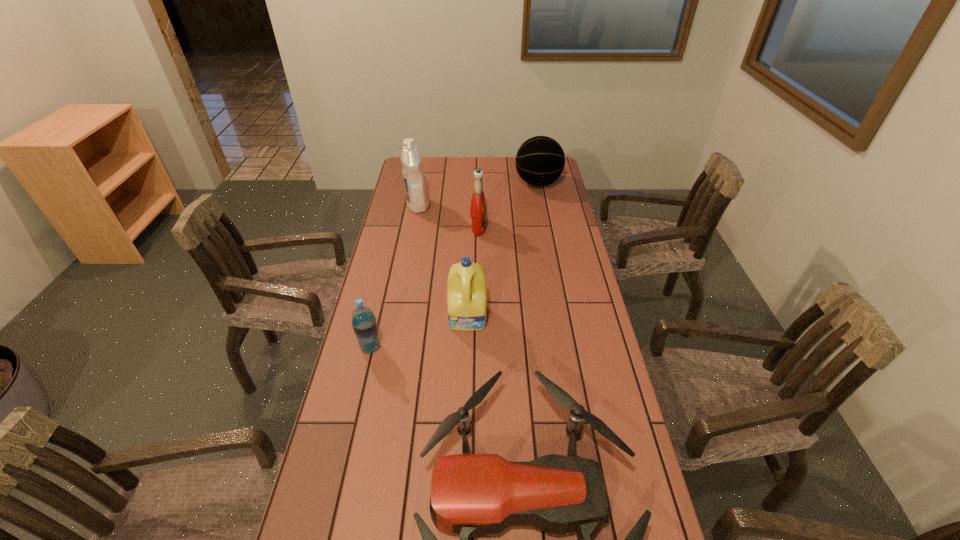
This screenshot has height=540, width=960. I want to click on the second farthest object, so click(413, 172).

Find the location of a particular element. The image size is (960, 540). the leftmost detergent is located at coordinates (413, 172).

What are the coordinates of `the third farthest object` in the screenshot? It's located at (478, 212).

This screenshot has width=960, height=540. I want to click on the nearest detergent, so click(467, 304).

The width and height of the screenshot is (960, 540). In order to click on the farthest object in this screenshot , I will do `click(540, 160)`.

The height and width of the screenshot is (540, 960). In order to click on the fifth farthest object in this screenshot , I will do `click(364, 323)`.

Locate an element on the screen. This screenshot has height=540, width=960. vacant area located 0.120m on the back of the farthest detergent is located at coordinates (422, 182).

Locate an element on the screen. The image size is (960, 540). vacant region located 0.270m on the front surface of the third farthest object is located at coordinates (555, 227).

Find the location of a particular element. vacant space situated 0.180m on the label of the nearest detergent is located at coordinates (467, 382).

Locate an element on the screen. vacant region located 0.070m on the front of the farthest object is located at coordinates (542, 205).